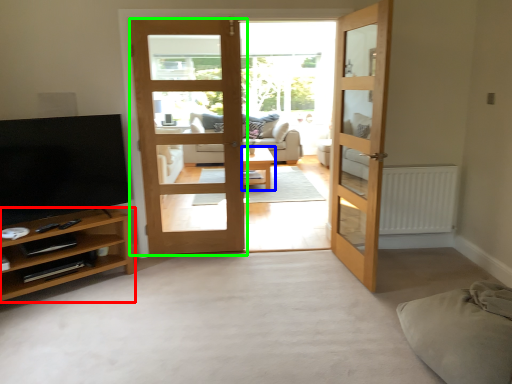
Question: Based on their relative distances, which object is farther from cabinetry (highlighted by a red box)? Choose from table (highlighted by a blue box) and door (highlighted by a green box).

Choices:
 (A) table
 (B) door

Answer: (A)